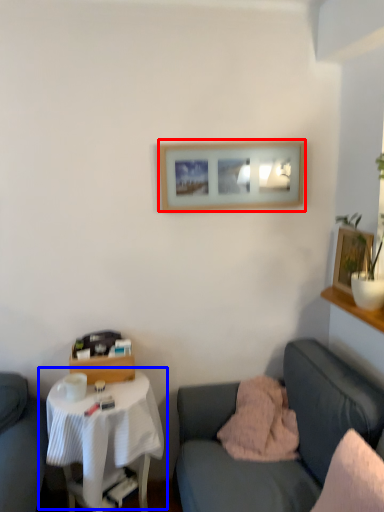
Question: Among these objects, which one is farthest to the camera, picture frame (highlighted by a red box) or table (highlighted by a blue box)?

Choices:
 (A) picture frame
 (B) table

Answer: (A)